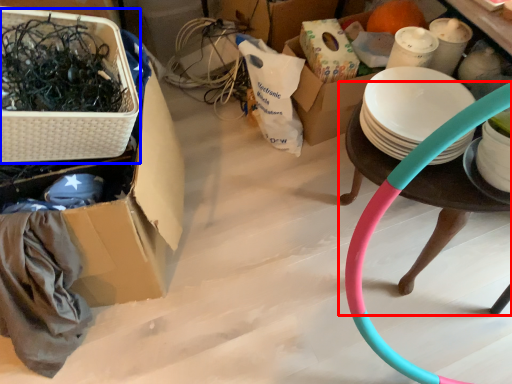
Question: Among these objects, which one is farthest to the camera, table (highlighted by a red box) or basket (highlighted by a blue box)?

Choices:
 (A) table
 (B) basket

Answer: (A)